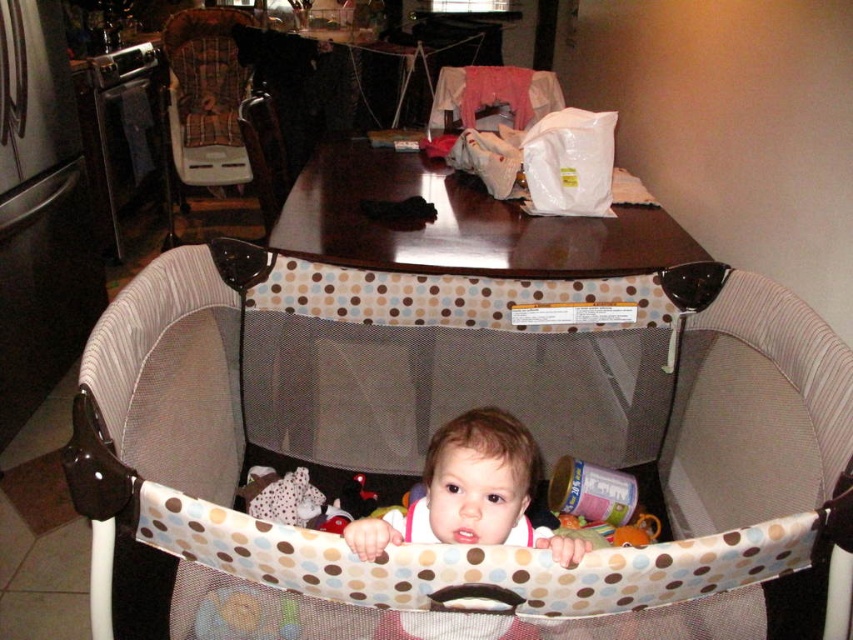
You are standing in the dining area and want to place a new decorative item at the point marked as point (228,179). Considering the baby playpen and the high chair, can you estimate how far this point is from where you are standing?

The distance of point (228,179) from the camera is 11.53 feet, so placing the decorative item there would require it to be 11.53 feet away from your current position.

You are a parent trying to choose between placing your baby in the plaid fabric highchair at left or the smooth beige baby playpen at center. Considering their heights, which one would you need to adjust to reach the table more comfortably?

The plaid fabric highchair at left has a greater height compared to the smooth beige baby playpen at center. Therefore, the baby would need to be adjusted to the plaid fabric highchair at left to reach the table more comfortably since it is taller.

You are a parent trying to choose seating for your child. You have two options in the image, the plaid fabric highchair at left and the wooden chair at center. Which one is bigger?

The plaid fabric highchair at left is larger in size than the wooden chair at center, so the plaid fabric highchair at left is bigger.